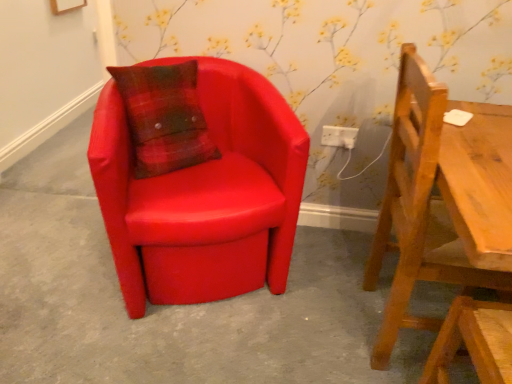
Question: From the image's perspective, is wooden chair at right, the second chair from the left, above matte leather chair at left, the second chair viewed from the right?

Choices:
 (A) no
 (B) yes

Answer: (A)

Question: Is wooden chair at right, the second chair from the left, far away from matte leather chair at left, the second chair viewed from the right?

Choices:
 (A) no
 (B) yes

Answer: (A)

Question: Is wooden chair at right, which is counted as the first chair, starting from the right, turned away from matte leather chair at left, acting as the 1th chair starting from the left?

Choices:
 (A) yes
 (B) no

Answer: (A)

Question: Is wooden chair at right, the second chair from the left, beside matte leather chair at left, acting as the 1th chair starting from the left?

Choices:
 (A) no
 (B) yes

Answer: (A)

Question: Does wooden chair at right, the second chair from the left, have a smaller size compared to matte leather chair at left, acting as the 1th chair starting from the left?

Choices:
 (A) yes
 (B) no

Answer: (A)

Question: Considering the positions of point pyautogui.click(x=281, y=375) and point pyautogui.click(x=336, y=145), is point pyautogui.click(x=281, y=375) closer or farther from the camera than point pyautogui.click(x=336, y=145)?

Choices:
 (A) farther
 (B) closer

Answer: (B)

Question: From a real-world perspective, relative to white plastic electric outlet at center, is matte red chair at center vertically above or below?

Choices:
 (A) above
 (B) below

Answer: (B)

Question: In terms of height, does matte red chair at center look taller or shorter compared to white plastic electric outlet at center?

Choices:
 (A) tall
 (B) short

Answer: (B)

Question: Would you say matte red chair at center is to the left or to the right of white plastic electric outlet at center in the picture?

Choices:
 (A) left
 (B) right

Answer: (A)

Question: Considering the positions of white plastic electric outlet at center and matte red chair at center in the image, is white plastic electric outlet at center taller or shorter than matte red chair at center?

Choices:
 (A) short
 (B) tall

Answer: (B)

Question: Considering their positions, is white plastic electric outlet at center located in front of or behind matte red chair at center?

Choices:
 (A) behind
 (B) front

Answer: (A)

Question: Looking at their shapes, would you say white plastic electric outlet at center is wider or thinner than matte red chair at center?

Choices:
 (A) thin
 (B) wide

Answer: (A)

Question: Choose the correct answer: Is white plastic electric outlet at center inside matte red chair at center or outside it?

Choices:
 (A) outside
 (B) inside

Answer: (A)

Question: Considering the relative positions of wooden chair at right, which is counted as the first chair, starting from the right, and white plastic electric outlet at center in the image provided, is wooden chair at right, which is counted as the first chair, starting from the right, to the left or to the right of white plastic electric outlet at center?

Choices:
 (A) right
 (B) left

Answer: (A)

Question: From the image's perspective, is wooden chair at right, the second chair from the left, above or below white plastic electric outlet at center?

Choices:
 (A) below
 (B) above

Answer: (A)